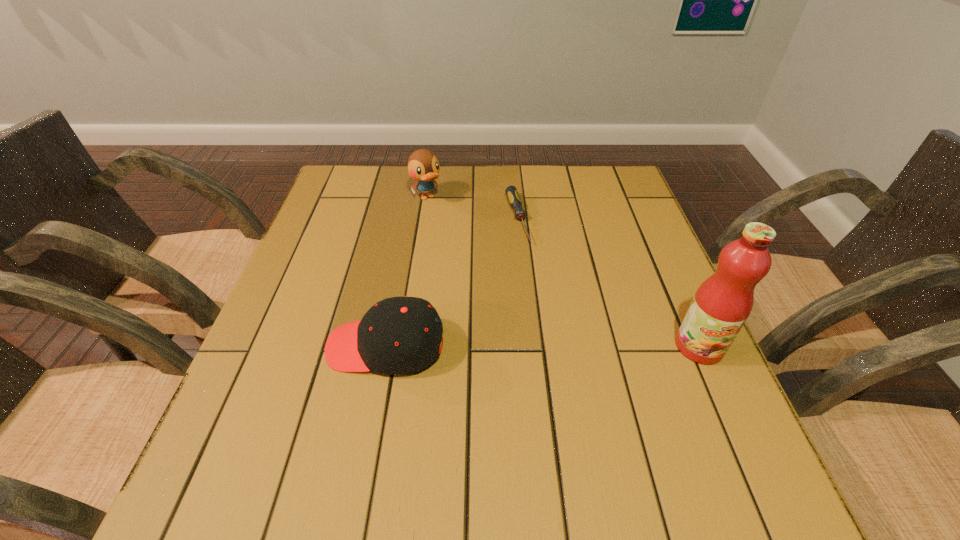
The width and height of the screenshot is (960, 540). In order to click on cap in this screenshot , I will do `click(399, 335)`.

I want to click on fruit juice, so [721, 305].

Image resolution: width=960 pixels, height=540 pixels. What are the coordinates of `the rightmost object` in the screenshot? It's located at (721, 305).

Find the location of `screwdriver`. screwdriver is located at coordinates (512, 194).

I want to click on the shortest object, so click(512, 194).

At what (x,y) coordinates should I click in order to perform the action: click on the third shortest object. Please return your answer as a coordinate pair (x, y). The height and width of the screenshot is (540, 960). Looking at the image, I should click on (423, 166).

Locate an element on the screen. The width and height of the screenshot is (960, 540). free point located 0.060m on the front-facing side of the third tallest object is located at coordinates (298, 346).

Identify the location of free space located on the front label of the tallest object. (738, 434).

Where is `vacant space located insert the second object from right to left into a screw head`? The image size is (960, 540). vacant space located insert the second object from right to left into a screw head is located at coordinates (558, 344).

Locate an element on the screen. The width and height of the screenshot is (960, 540). vacant position located insert the second object from right to left into a screw head is located at coordinates 536,286.